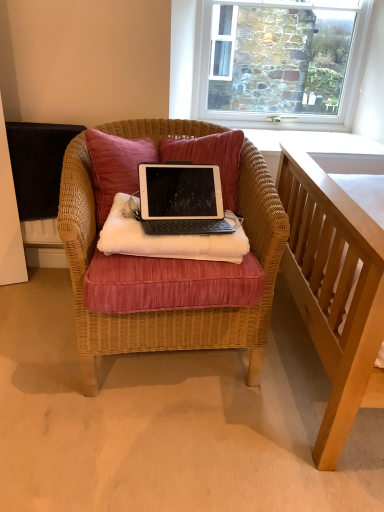
Question: Is velvet pink pillow at center closer to the viewer compared to silver/black plastic laptop at center?

Choices:
 (A) yes
 (B) no

Answer: (B)

Question: From a real-world perspective, is velvet pink pillow at center positioned over silver/black plastic laptop at center based on gravity?

Choices:
 (A) no
 (B) yes

Answer: (B)

Question: Can you confirm if velvet pink pillow at center is thinner than silver/black plastic laptop at center?

Choices:
 (A) yes
 (B) no

Answer: (B)

Question: From the image's perspective, would you say velvet pink pillow at center is shown under silver/black plastic laptop at center?

Choices:
 (A) yes
 (B) no

Answer: (B)

Question: Are velvet pink pillow at center and silver/black plastic laptop at center beside each other?

Choices:
 (A) yes
 (B) no

Answer: (B)

Question: Is black matte tablet at center in front of or behind velvet pink pillow at center in the image?

Choices:
 (A) front
 (B) behind

Answer: (A)

Question: In terms of height, does black matte tablet at center look taller or shorter compared to velvet pink pillow at center?

Choices:
 (A) tall
 (B) short

Answer: (B)

Question: Which is correct: black matte tablet at center is inside velvet pink pillow at center, or outside of it?

Choices:
 (A) inside
 (B) outside

Answer: (B)

Question: Is black matte tablet at center bigger or smaller than velvet pink pillow at center?

Choices:
 (A) small
 (B) big

Answer: (A)

Question: In terms of height, does black matte tablet at center look taller or shorter compared to stone textured wall at upper center?

Choices:
 (A) short
 (B) tall

Answer: (A)

Question: In terms of width, does black matte tablet at center look wider or thinner when compared to stone textured wall at upper center?

Choices:
 (A) wide
 (B) thin

Answer: (A)

Question: Considering the positions of point (112, 212) and point (281, 15), is point (112, 212) closer or farther from the camera than point (281, 15)?

Choices:
 (A) closer
 (B) farther

Answer: (A)

Question: Considering the relative positions of black matte tablet at center and stone textured wall at upper center in the image provided, is black matte tablet at center to the left or to the right of stone textured wall at upper center?

Choices:
 (A) right
 (B) left

Answer: (B)

Question: Considering the positions of woven wicker chair at center and stone textured wall at upper center in the image, is woven wicker chair at center taller or shorter than stone textured wall at upper center?

Choices:
 (A) short
 (B) tall

Answer: (B)

Question: Is point (238, 189) closer or farther from the camera than point (220, 28)?

Choices:
 (A) farther
 (B) closer

Answer: (B)